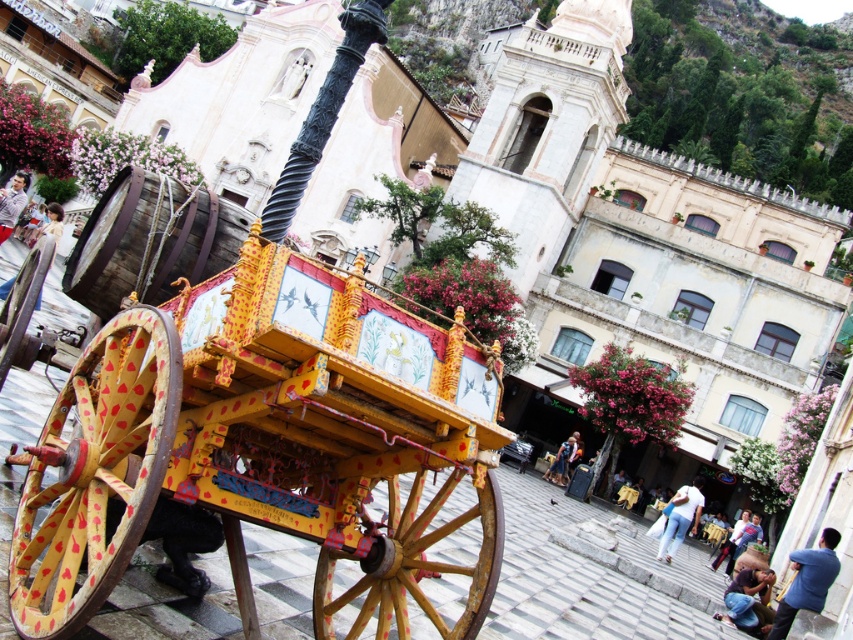
You are standing in front of the ornate wooden cart and see both the blue cotton shirt at lower right and the light brown leather jacket at center. Which clothing item is positioned more to the east side of the cart?

The blue cotton shirt at lower right is to the right of the light brown leather jacket at center, so it is positioned more to the east side of the cart.